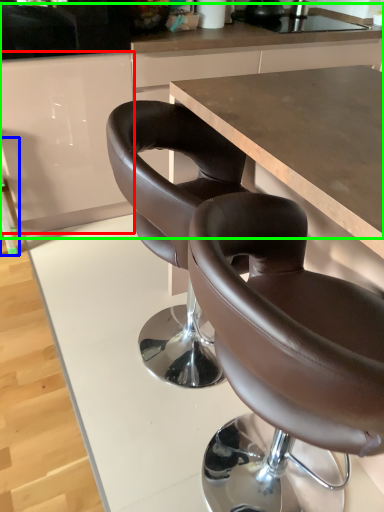
Question: Which is nearer to the cabinetry (highlighted by a red box)? bar stool (highlighted by a blue box) or counter (highlighted by a green box).

Choices:
 (A) bar stool
 (B) counter

Answer: (B)